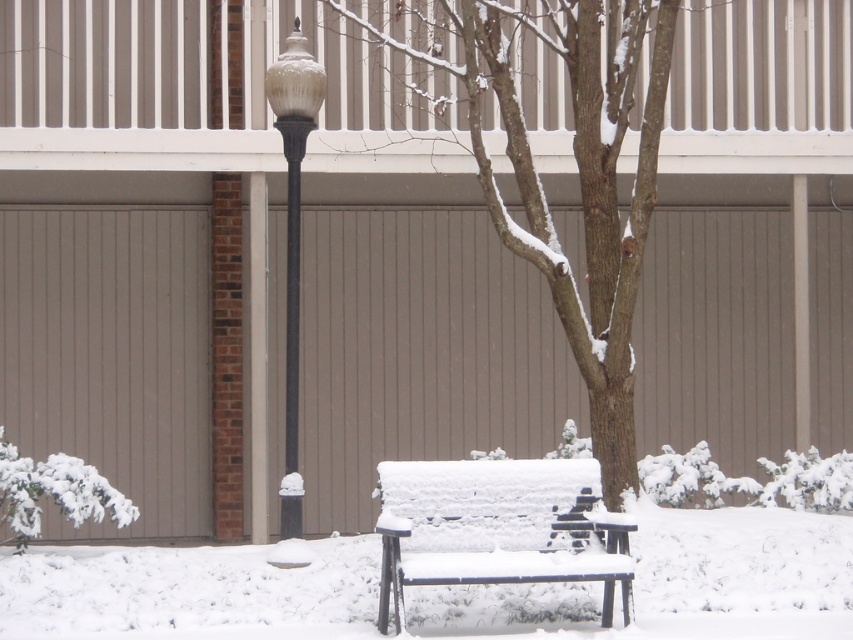
Does matte gray garage door at left lie behind snow-covered wood bench at center?

That is True.

What do you see at coordinates (111, 355) in the screenshot? I see `matte gray garage door at left` at bounding box center [111, 355].

Is point (146, 339) farther from camera compared to point (434, 556)?

Yes, it is.

I want to click on matte gray garage door at left, so click(x=111, y=355).

Does matte gray garage door at left appear under glossy black lamp post at center?

Correct, matte gray garage door at left is located below glossy black lamp post at center.

Does matte gray garage door at left have a smaller size compared to glossy black lamp post at center?

No, matte gray garage door at left is not smaller than glossy black lamp post at center.

Is point (45, 536) less distant than point (300, 81)?

No, (45, 536) is further to viewer.

The image size is (853, 640). In order to click on matte gray garage door at left in this screenshot , I will do `click(111, 355)`.

Which is more to the left, matte gray garage door at left or smooth brown tree trunk at center?

matte gray garage door at left

Can you confirm if matte gray garage door at left is smaller than smooth brown tree trunk at center?

Correct, matte gray garage door at left occupies less space than smooth brown tree trunk at center.

Is point (173, 456) farther from camera compared to point (636, 13)?

That is True.

At what (x,y) coordinates should I click in order to perform the action: click on matte gray garage door at left. Please return your answer as a coordinate pair (x, y). Looking at the image, I should click on point(111,355).